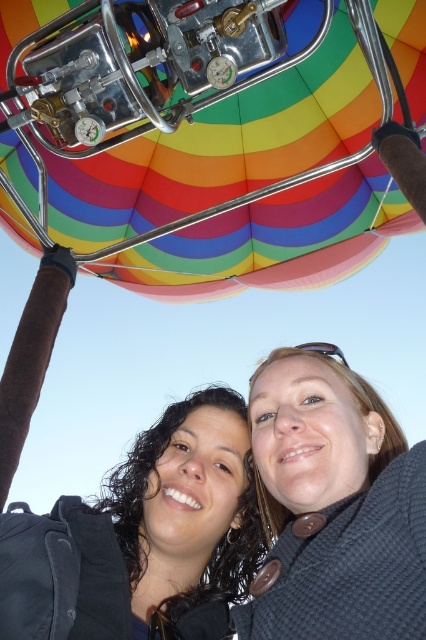
Question: Is rainbow fabric balloon at upper center positioned behind smooth skin face at center?

Choices:
 (A) no
 (B) yes

Answer: (B)

Question: Can you confirm if rainbow fabric balloon at upper center is positioned below smooth skin face at center?

Choices:
 (A) yes
 (B) no

Answer: (B)

Question: Which point is closer to the camera?

Choices:
 (A) (236, 449)
 (B) (227, 131)

Answer: (A)

Question: Can you confirm if rainbow fabric balloon at upper center is smaller than smooth skin face at center?

Choices:
 (A) no
 (B) yes

Answer: (A)

Question: Among these objects, which one is nearest to the camera?

Choices:
 (A) smooth skin face at center
 (B) rainbow fabric balloon at upper center

Answer: (A)